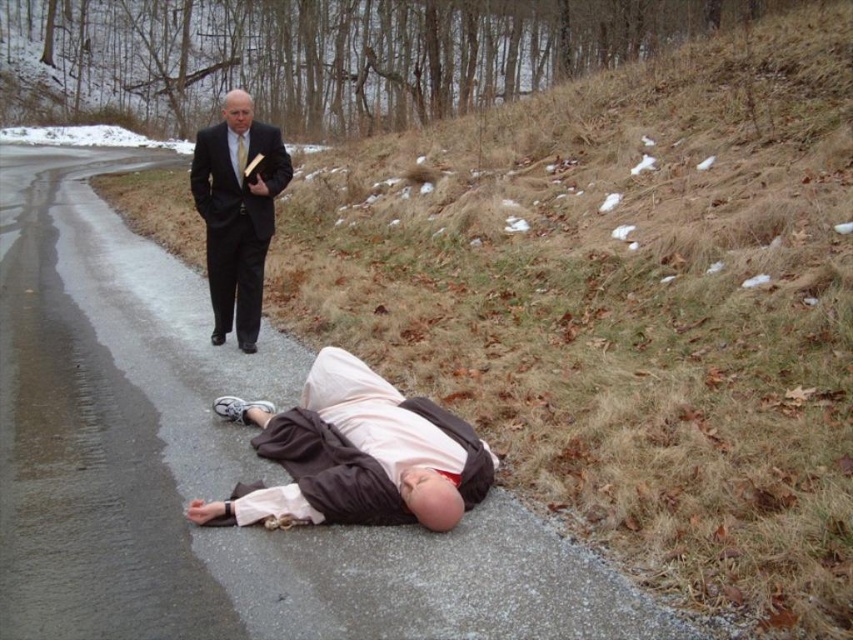
Question: Is brown fabric shirt at lower center above matte black suit at upper left?

Choices:
 (A) no
 (B) yes

Answer: (A)

Question: Which point is closer to the camera?

Choices:
 (A) (258, 278)
 (B) (306, 429)

Answer: (B)

Question: Does brown fabric shirt at lower center have a smaller size compared to matte black suit at upper left?

Choices:
 (A) no
 (B) yes

Answer: (B)

Question: Which object appears closest to the camera in this image?

Choices:
 (A) matte black suit at upper left
 (B) brown fabric shirt at lower center

Answer: (B)

Question: Observing the image, what is the correct spatial positioning of brown fabric shirt at lower center in reference to matte black suit at upper left?

Choices:
 (A) right
 (B) left

Answer: (A)